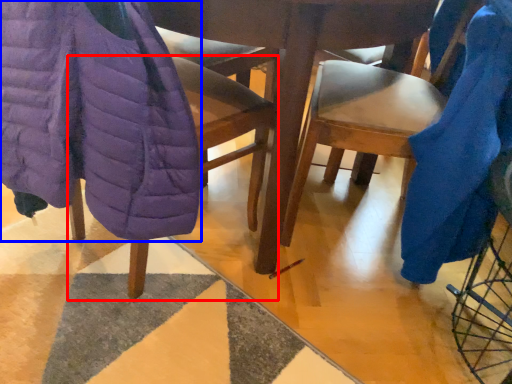
Question: Which of the following is the closest to the observer, chair (highlighted by a red box) or blanket (highlighted by a blue box)?

Choices:
 (A) chair
 (B) blanket

Answer: (B)